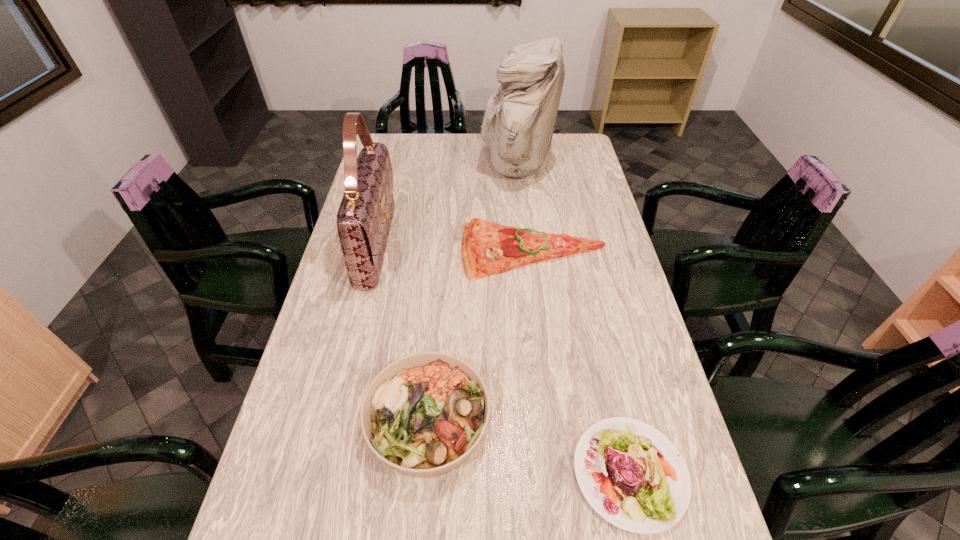
Identify the location of free spot located on the left of the taller salad plate. (286, 422).

At what (x,y) coordinates should I click in order to perform the action: click on vacant space located on the back of the pizza. Please return your answer as a coordinate pair (x, y). Image resolution: width=960 pixels, height=540 pixels. Looking at the image, I should click on (524, 174).

This screenshot has width=960, height=540. I want to click on vacant space located 0.280m on the back of the right salad plate, so click(596, 325).

Where is `object that is positioned at the far edge`? The height and width of the screenshot is (540, 960). object that is positioned at the far edge is located at coordinates (519, 120).

Where is `object at the left edge`? The image size is (960, 540). object at the left edge is located at coordinates (364, 218).

Find the location of a particular element. Image resolution: width=960 pixels, height=540 pixels. pizza positioned at the right edge is located at coordinates (487, 248).

Find the location of a particular element. This screenshot has height=540, width=960. salad plate that is positioned at the right edge is located at coordinates (632, 475).

Locate an element on the screen. The image size is (960, 540). free location at the far edge is located at coordinates (470, 133).

Find the location of a particular element. This screenshot has width=960, height=540. vacant space at the left edge is located at coordinates (301, 390).

What are the coordinates of `vacant space at the right edge of the desktop` in the screenshot? It's located at (614, 265).